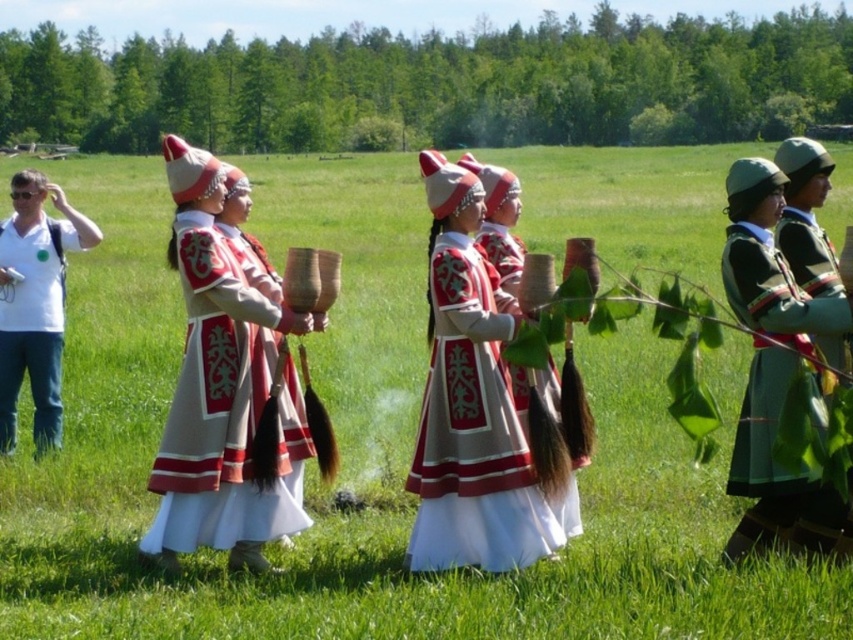
Question: Which is nearer to the white cotton shirt at left?

Choices:
 (A) embroidered cotton dress at center
 (B) beige fabric dress at center
 (C) green woolen jacket at right

Answer: (B)

Question: Does white cotton shirt at left have a lesser width compared to green matte jacket at right?

Choices:
 (A) no
 (B) yes

Answer: (A)

Question: Is green woolen jacket at right smaller than white cotton shirt at left?

Choices:
 (A) yes
 (B) no

Answer: (B)

Question: Which of these objects is positioned closest to the green woolen jacket at right?

Choices:
 (A) beige fabric dress at center
 (B) white cotton shirt at left
 (C) embroidered silk dress at center

Answer: (C)

Question: Among these points, which one is farthest from the camera?

Choices:
 (A) (763, 445)
 (B) (579, 460)
 (C) (187, 545)
 (D) (554, 522)

Answer: (B)

Question: Does beige fabric dress at center appear over white cotton shirt at left?

Choices:
 (A) no
 (B) yes

Answer: (A)